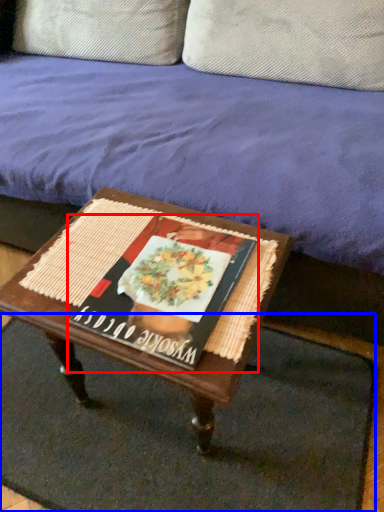
Question: Which object is further to the camera taking this photo, magazine (highlighted by a red box) or doormat (highlighted by a blue box)?

Choices:
 (A) magazine
 (B) doormat

Answer: (B)